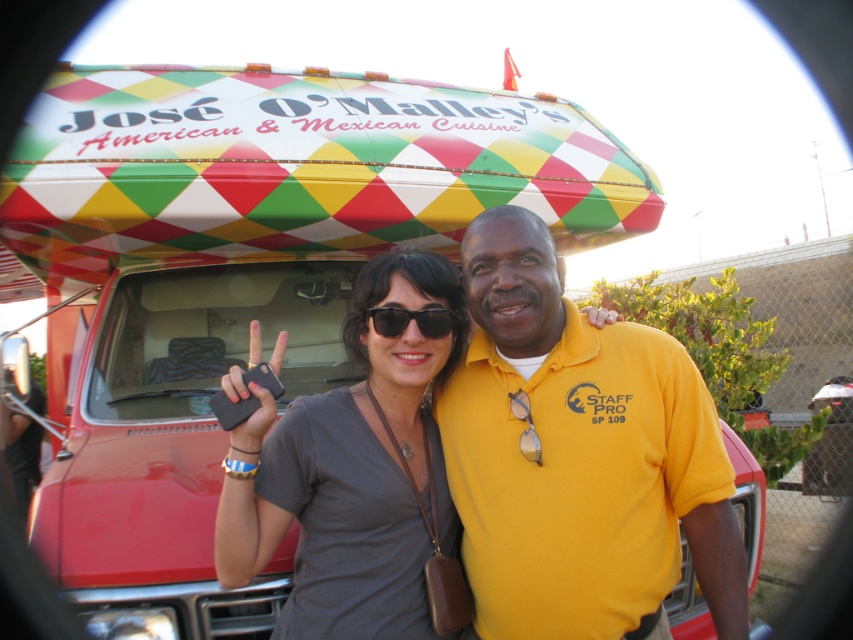
Is yellow cotton polo shirt at center thinner than gray matte shirt at center?

Incorrect, yellow cotton polo shirt at center's width is not less than gray matte shirt at center's.

Find the location of a particular element. The height and width of the screenshot is (640, 853). yellow cotton polo shirt at center is located at coordinates (x=578, y=456).

What are the coordinates of `yellow cotton polo shirt at center` in the screenshot? It's located at (578, 456).

Can you confirm if yellow cotton polo shirt at center is smaller than black plastic sunglasses at center?

Incorrect, yellow cotton polo shirt at center is not smaller in size than black plastic sunglasses at center.

Who is taller, yellow cotton polo shirt at center or black plastic sunglasses at center?

Standing taller between the two is yellow cotton polo shirt at center.

You are a GUI agent. You are given a task and a screenshot of the screen. Output one action in this format:
    pyautogui.click(x=<x>, y=<y>)
    Task: Click on the yellow cotton polo shirt at center
    The image size is (853, 640).
    Given the screenshot: What is the action you would take?
    pyautogui.click(x=578, y=456)

You are a GUI agent. You are given a task and a screenshot of the screen. Output one action in this format:
    pyautogui.click(x=<x>, y=<y>)
    Task: Click on the gray matte shirt at center
    This screenshot has width=853, height=640.
    Given the screenshot: What is the action you would take?
    pyautogui.click(x=350, y=472)